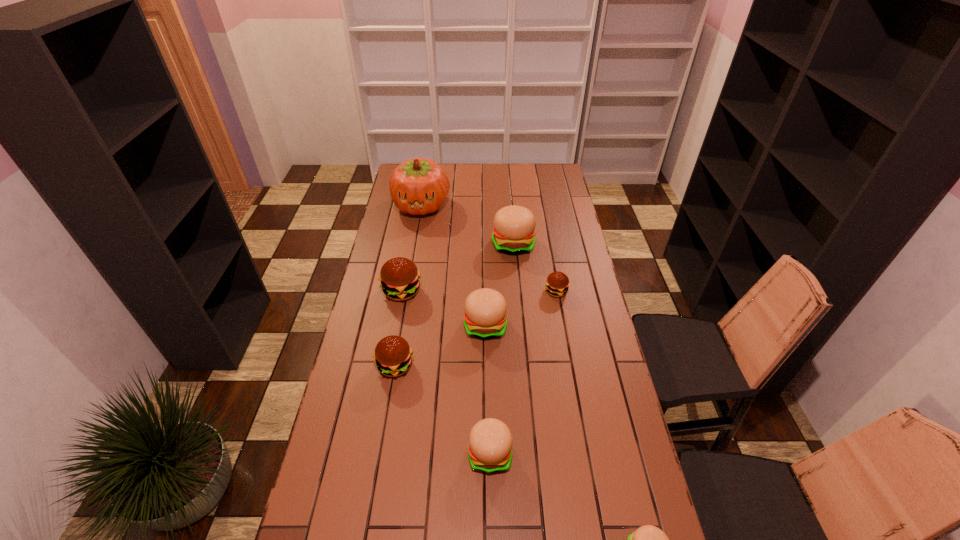
Find the location of a particular element. The image size is (960, 540). the fifth closest object to the fifth farthest hamburger is located at coordinates (513, 233).

Select which hamburger appears as the seventh closest to the green pumpkin. Please provide its 2D coordinates. Your answer should be formatted as a tuple, i.e. [(x, y)], where the tuple contains the x and y coordinates of a point satisfying the conditions above.

[(647, 539)]

Identify which hamburger is located as the nearest to the smallest brown hamburger. Please provide its 2D coordinates. Your answer should be formatted as a tuple, i.e. [(x, y)], where the tuple contains the x and y coordinates of a point satisfying the conditions above.

[(513, 233)]

Where is `beige hamburger that stands as the third closest to the fourth nearest hamburger`? beige hamburger that stands as the third closest to the fourth nearest hamburger is located at coordinates (647, 539).

Where is `beige hamburger that stands as the closest to the second nearest object`? beige hamburger that stands as the closest to the second nearest object is located at coordinates (647, 539).

Choose which brown hamburger is the nearest neighbor to the second farthest object. Please provide its 2D coordinates. Your answer should be formatted as a tuple, i.e. [(x, y)], where the tuple contains the x and y coordinates of a point satisfying the conditions above.

[(557, 283)]

Locate an element on the screen. brown hamburger that stands as the closest to the farthest beige hamburger is located at coordinates (557, 283).

Find the location of a particular element. free region that satisfies the following two spatial constraints: 1. on the side of the third farthest beige hamburger with the cute face; 2. on the left side of the farthest object is located at coordinates (379, 453).

This screenshot has width=960, height=540. I want to click on blank area in the image that satisfies the following two spatial constraints: 1. on the side of the fourth farthest hamburger with the cute face; 2. on the right side of the tallest object, so click(401, 325).

Identify the location of vacant region that satisfies the following two spatial constraints: 1. on the back side of the biggest brown hamburger; 2. on the right side of the smallest brown hamburger. (402, 291).